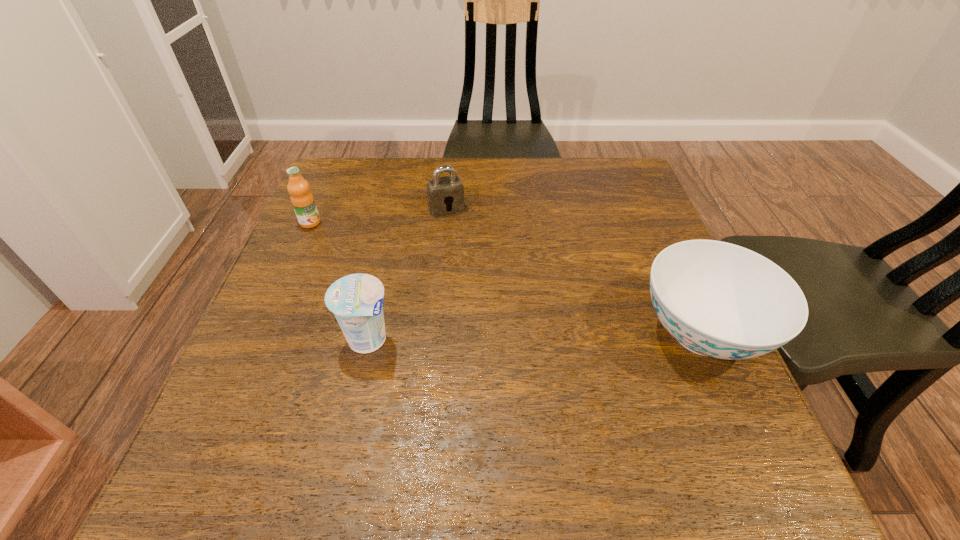
Find the location of a particular element. The width and height of the screenshot is (960, 540). yogurt is located at coordinates (356, 300).

I want to click on chinaware, so click(x=717, y=299).

Where is `orange juice`? The image size is (960, 540). orange juice is located at coordinates (302, 199).

At what (x,y) coordinates should I click in order to perform the action: click on the third object from left to right. Please return your answer as a coordinate pair (x, y). Image resolution: width=960 pixels, height=540 pixels. Looking at the image, I should click on (444, 194).

Locate an element on the screen. The image size is (960, 540). vacant space located 0.050m on the front of the yogurt is located at coordinates (358, 385).

The image size is (960, 540). What are the coordinates of `vacant area situated on the left of the rightmost object` in the screenshot? It's located at (502, 333).

At what (x,y) coordinates should I click in order to perform the action: click on vacant region located 0.360m on the label of the leftmost object. Please return your answer as a coordinate pair (x, y). Looking at the image, I should click on tap(429, 287).

At what (x,y) coordinates should I click in order to perform the action: click on vacant point located 0.240m on the label of the leftmost object. Please return your answer as a coordinate pair (x, y). This screenshot has width=960, height=540. Looking at the image, I should click on (388, 265).

At what (x,y) coordinates should I click in order to perform the action: click on free space located on the label of the leftmost object. Please return your answer as a coordinate pair (x, y). The image size is (960, 540). Looking at the image, I should click on (436, 292).

At what (x,y) coordinates should I click in order to perform the action: click on free point located 0.100m at the front of the padlock near the keyhole. Please return your answer as a coordinate pair (x, y). Image resolution: width=960 pixels, height=540 pixels. Looking at the image, I should click on (465, 240).